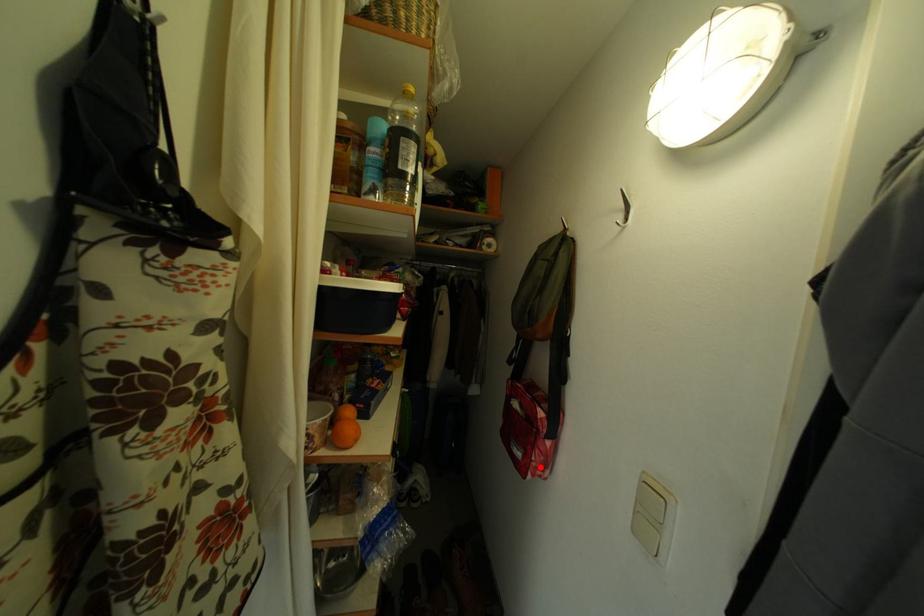
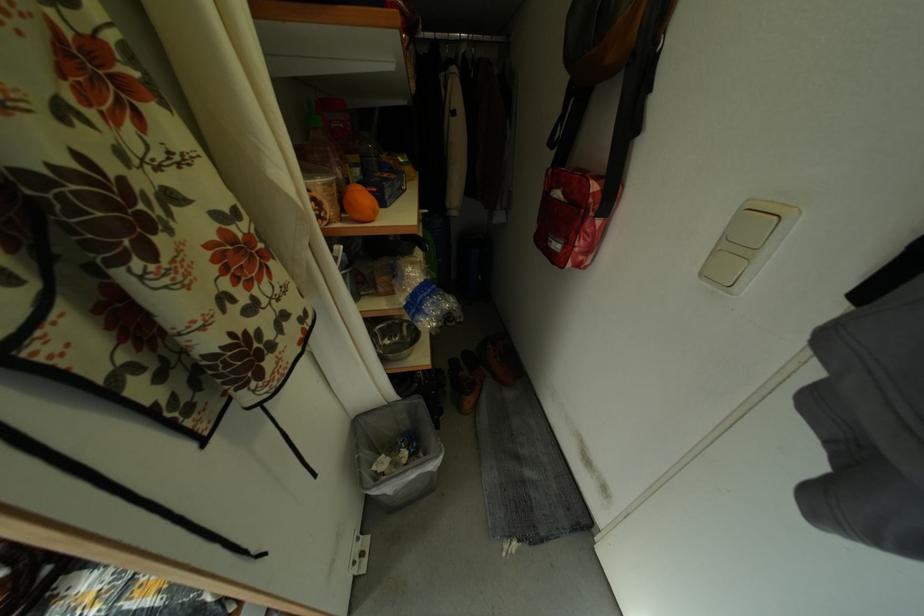
Question: A red point is marked in image1. In image2, is the corresponding 3D point closer to the camera or farther? Reply with the corresponding letter.

Choices:
 (A) The corresponding 3D point is closer.
 (B) The corresponding 3D point is farther.

Answer: (A)